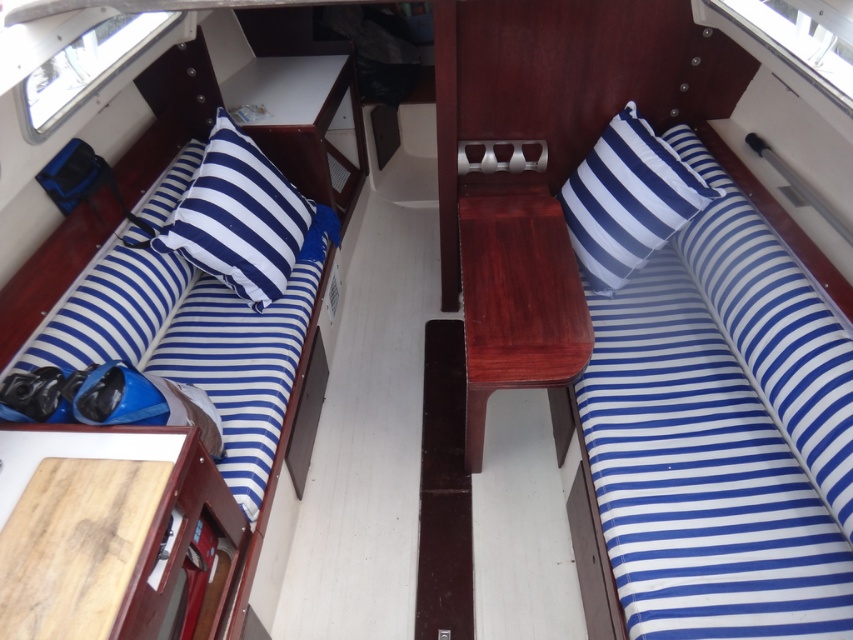
You are inside the boat cabin and want to place a small backpack between the blue striped pillow at left and the blue striped cushion at upper right. Can you do this without moving either object?

The blue striped cushion at upper right is behind the blue striped pillow at left, so there is no space in between them for placing the backpack.

You are inside the boat cabin and want to place a small item on the blue striped pillow at left. Can you tell me the exact 2D coordinates where you should place it?

The blue striped pillow at left is located at 2D coordinates point (238, 218).